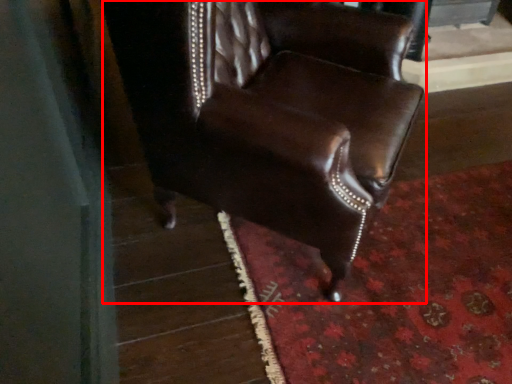
Question: Observing the image, what is the correct spatial positioning of chair (annotated by the red box) in reference to mat?

Choices:
 (A) left
 (B) right

Answer: (A)